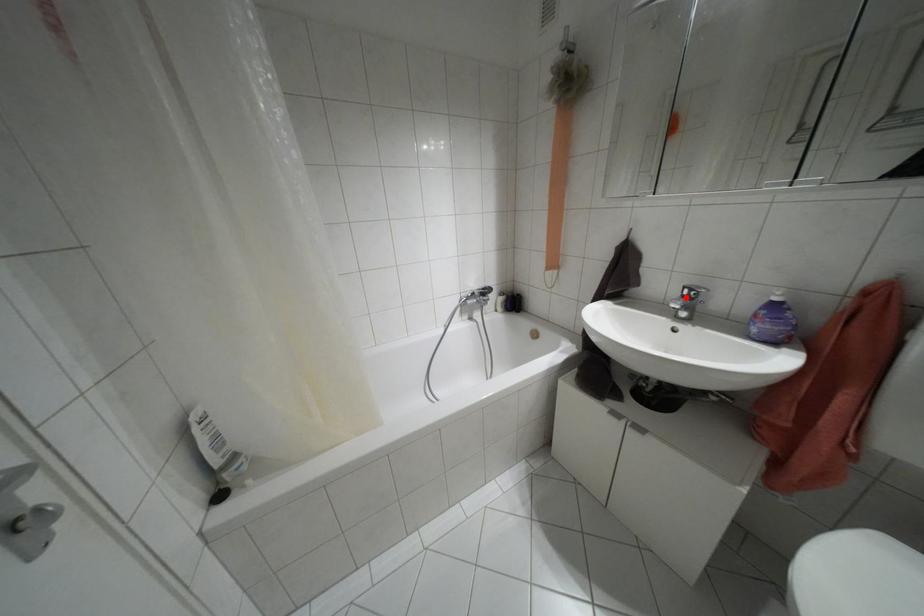
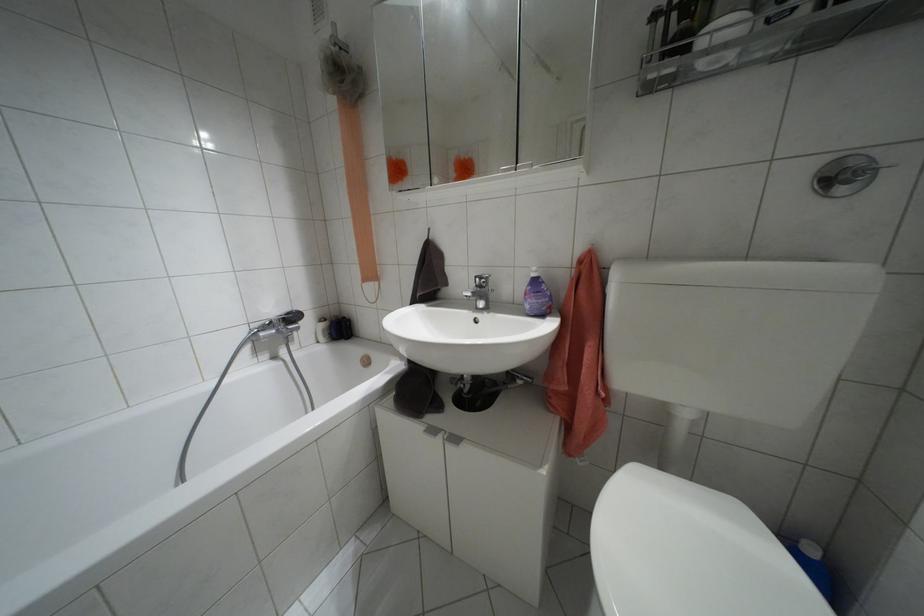
Where in the second image is the point corresponding to the highlighted location from the first image?

(479, 286)